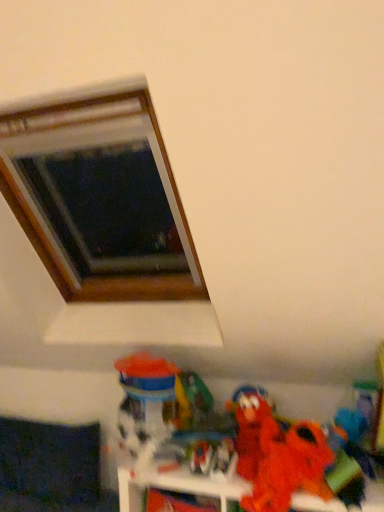
Describe the element at coordinates (51, 468) in the screenshot. I see `dark fabric couch at lower left` at that location.

Describe the element at coordinates (224, 458) in the screenshot. The width and height of the screenshot is (384, 512). I see `matte plastic toy at lower center, the 3th toy in the left-to-right sequence` at that location.

At what (x,y) coordinates should I click in order to perform the action: click on wooden frame at upper left. Please return your answer as a coordinate pair (x, y). This screenshot has height=512, width=384. Looking at the image, I should click on (105, 217).

What do you see at coordinates (278, 457) in the screenshot? I see `fuzzy red plush at lower right, arranged as the fifth toy when viewed from the left` at bounding box center [278, 457].

Where is `translucent plastic toy at lower center, acting as the 5th toy starting from the right`? This screenshot has height=512, width=384. translucent plastic toy at lower center, acting as the 5th toy starting from the right is located at coordinates pyautogui.click(x=149, y=405).

Who is taller, fuzzy fabric plush at lower right or matte red plush at lower right, placed as the second toy when sorted from right to left?

fuzzy fabric plush at lower right.

The height and width of the screenshot is (512, 384). There is a fuzzy fabric plush at lower right. In order to click on the 4th toy above it (from a real-world perspective) in this screenshot , I will do `click(252, 430)`.

Which is more to the left, fuzzy fabric plush at lower right or matte red plush at lower right, acting as the fourth toy starting from the left?

Positioned to the left is matte red plush at lower right, acting as the fourth toy starting from the left.

Which point is more forward, [97,486] or [244,448]?

The point [244,448] is in front.

Which object is thinner, dark fabric couch at lower left or fuzzy red plush at lower right, arranged as the fifth toy when viewed from the left?

fuzzy red plush at lower right, arranged as the fifth toy when viewed from the left.

From a real-world perspective, is dark fabric couch at lower left above or below fuzzy red plush at lower right, arranged as the fifth toy when viewed from the left?

From a real-world perspective, dark fabric couch at lower left is physically below fuzzy red plush at lower right, arranged as the fifth toy when viewed from the left.

Considering the positions of objects fuzzy fabric plush at lower right and wooden frame at upper left in the image provided, who is in front, fuzzy fabric plush at lower right or wooden frame at upper left?

fuzzy fabric plush at lower right is closer to the camera.

Would you consider fuzzy fabric plush at lower right to be distant from wooden frame at upper left?

No, fuzzy fabric plush at lower right is not far away from wooden frame at upper left.

Locate an element on the screen. The height and width of the screenshot is (512, 384). shelf below the wooden frame at upper left (from the image's perspective) is located at coordinates (200, 485).

Based on the photo, can you confirm if fuzzy fabric plush at lower right is taller than wooden frame at upper left?

In fact, fuzzy fabric plush at lower right may be shorter than wooden frame at upper left.

Based on the photo, are matte plastic toy at lower center, the fourth toy positioned from the right, and fuzzy red plush at lower right, which is the first toy from right to left, beside each other?

No, matte plastic toy at lower center, the fourth toy positioned from the right, is not next to fuzzy red plush at lower right, which is the first toy from right to left.

From a real-world perspective, which object rests below the other?

From a 3D spatial view, matte plastic toy at lower center, the fourth toy positioned from the right, is below.

Is the position of matte plastic toy at lower center, the fourth toy positioned from the right, more distant than that of fuzzy red plush at lower right, which is the first toy from right to left?

Yes, matte plastic toy at lower center, the fourth toy positioned from the right, is behind fuzzy red plush at lower right, which is the first toy from right to left.

Based on their positions, is matte plastic toy at lower center, the fourth toy positioned from the right, located to the left or right of fuzzy red plush at lower right, which is the first toy from right to left?

Clearly, matte plastic toy at lower center, the fourth toy positioned from the right, is on the left of fuzzy red plush at lower right, which is the first toy from right to left, in the image.

Is dark fabric couch at lower left inside or outside of wooden frame at upper left?

dark fabric couch at lower left is not inside wooden frame at upper left, it's outside.

Between dark fabric couch at lower left and wooden frame at upper left, which one has larger width?

wooden frame at upper left.

From a real-world perspective, between dark fabric couch at lower left and wooden frame at upper left, who is vertically higher?

wooden frame at upper left, from a real-world perspective.

Considering the relative sizes of dark fabric couch at lower left and wooden frame at upper left in the image provided, is dark fabric couch at lower left smaller than wooden frame at upper left?

Correct, dark fabric couch at lower left occupies less space than wooden frame at upper left.

How much distance is there between matte red plush at lower right, acting as the fourth toy starting from the left, and fuzzy fabric plush at lower right?

A distance of 7.50 inches exists between matte red plush at lower right, acting as the fourth toy starting from the left, and fuzzy fabric plush at lower right.

Is point (237, 431) farther from viewer compared to point (377, 509)?

That is True.

Is the surface of matte red plush at lower right, acting as the fourth toy starting from the left, in direct contact with fuzzy fabric plush at lower right?

There is a gap between matte red plush at lower right, acting as the fourth toy starting from the left, and fuzzy fabric plush at lower right.

From the image's perspective, is matte red plush at lower right, acting as the fourth toy starting from the left, below fuzzy fabric plush at lower right?

Incorrect, from the image's perspective, matte red plush at lower right, acting as the fourth toy starting from the left, is higher than fuzzy fabric plush at lower right.

Is fuzzy fabric plush at lower right positioned beyond the bounds of dark fabric couch at lower left?

Yes.

Considering the relative sizes of fuzzy fabric plush at lower right and dark fabric couch at lower left in the image provided, is fuzzy fabric plush at lower right smaller than dark fabric couch at lower left?

No, fuzzy fabric plush at lower right is not smaller than dark fabric couch at lower left.

Is fuzzy fabric plush at lower right in front of or behind dark fabric couch at lower left in the image?

In the image, fuzzy fabric plush at lower right appears in front of dark fabric couch at lower left.

Where is `shelf that is in front of the matte red plush at lower right, acting as the fourth toy starting from the left`? This screenshot has width=384, height=512. shelf that is in front of the matte red plush at lower right, acting as the fourth toy starting from the left is located at coordinates (200, 485).

Locate an element on the screen. Image resolution: width=384 pixels, height=512 pixels. couch below the fuzzy red plush at lower right, which is the first toy from right to left (from the image's perspective) is located at coordinates (51, 468).

Estimate the real-world distances between objects in this image. Which object is closer to matte red plush at lower right, placed as the second toy when sorted from right to left, dark fabric couch at lower left or matte plastic toy at lower center, arranged as the third toy when viewed from the right?

matte plastic toy at lower center, arranged as the third toy when viewed from the right, lies closer to matte red plush at lower right, placed as the second toy when sorted from right to left, than the other object.

From the image, which object appears to be nearer to matte red plush at lower right, placed as the second toy when sorted from right to left, fuzzy red plush at lower right, arranged as the fifth toy when viewed from the left, or wooden frame at upper left?

Among the two, fuzzy red plush at lower right, arranged as the fifth toy when viewed from the left, is located nearer to matte red plush at lower right, placed as the second toy when sorted from right to left.

Based on their spatial positions, is matte plastic toy at lower center, the fourth toy positioned from the right, or dark fabric couch at lower left closer to wooden frame at upper left?

dark fabric couch at lower left is closer to wooden frame at upper left.

Based on their spatial positions, is translucent plastic toy at lower center, which ranks as the first toy in left-to-right order, or dark fabric couch at lower left closer to fuzzy red plush at lower right, arranged as the fifth toy when viewed from the left?

The object closer to fuzzy red plush at lower right, arranged as the fifth toy when viewed from the left, is translucent plastic toy at lower center, which ranks as the first toy in left-to-right order.

From the image, which object appears to be nearer to matte plastic toy at lower center, arranged as the third toy when viewed from the right, wooden frame at upper left or translucent plastic toy at lower center, acting as the 5th toy starting from the right?

The object closer to matte plastic toy at lower center, arranged as the third toy when viewed from the right, is translucent plastic toy at lower center, acting as the 5th toy starting from the right.

Looking at the image, which one is located closer to fuzzy fabric plush at lower right, fuzzy red plush at lower right, arranged as the fifth toy when viewed from the left, or dark fabric couch at lower left?

fuzzy red plush at lower right, arranged as the fifth toy when viewed from the left, is closer to fuzzy fabric plush at lower right.

In the scene shown: When comparing their distances from translucent plastic toy at lower center, which ranks as the first toy in left-to-right order, does dark fabric couch at lower left or matte red plush at lower right, acting as the fourth toy starting from the left, seem closer?

Among the two, matte red plush at lower right, acting as the fourth toy starting from the left, is located nearer to translucent plastic toy at lower center, which ranks as the first toy in left-to-right order.

Estimate the real-world distances between objects in this image. Which object is further from wooden frame at upper left, dark fabric couch at lower left or translucent plastic toy at lower center, which ranks as the first toy in left-to-right order?

Based on the image, dark fabric couch at lower left appears to be further to wooden frame at upper left.

This screenshot has height=512, width=384. I want to click on shelf between dark fabric couch at lower left and fuzzy red plush at lower right, which is the first toy from right to left, from left to right, so click(200, 485).

Where is `couch between wooden frame at upper left and fuzzy fabric plush at lower right in the vertical direction`? The height and width of the screenshot is (512, 384). couch between wooden frame at upper left and fuzzy fabric plush at lower right in the vertical direction is located at coordinates (51, 468).

The image size is (384, 512). Identify the location of toy located between matte plastic toy at lower center, the fourth toy positioned from the right, and matte red plush at lower right, placed as the second toy when sorted from right to left, in the left-right direction. (224, 458).

The height and width of the screenshot is (512, 384). Find the location of `shelf between translucent plastic toy at lower center, which ranks as the first toy in left-to-right order, and fuzzy red plush at lower right, arranged as the fifth toy when viewed from the left, in the horizontal direction`. shelf between translucent plastic toy at lower center, which ranks as the first toy in left-to-right order, and fuzzy red plush at lower right, arranged as the fifth toy when viewed from the left, in the horizontal direction is located at coordinates (200, 485).